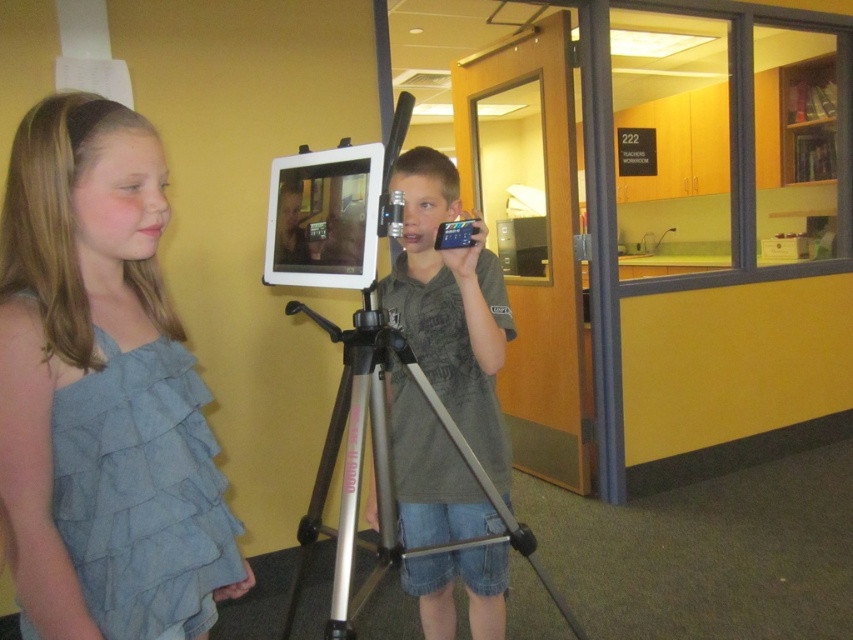
You are a photographer trying to capture a clear shot of the gray cotton shirt at center without the denim ruffled top at left blocking it. Can you adjust your position to do so?

The denim ruffled top at left is positioned over gray cotton shirt at center, so moving to the side might allow you to see the gray cotton shirt at center without obstruction.

Looking at this image, you are standing in the room and want to move from the point at coordinates point (21, 618) to the point at coordinates point (421, 509). Can you walk directly between them without any obstacles?

Since point (21, 618) is in front of point (421, 509), you can walk directly between them without any obstacles.